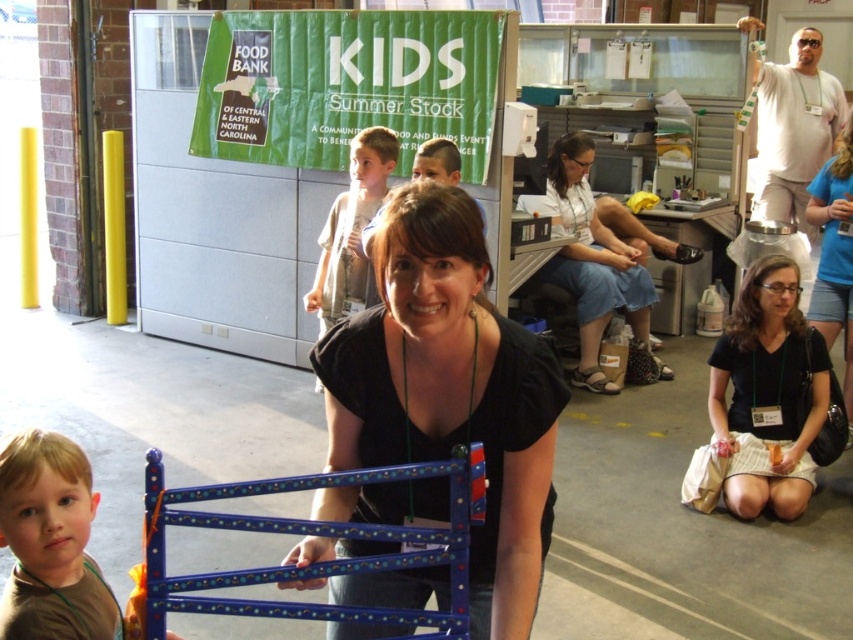
Question: Estimate the real-world distances between objects in this image. Which object is farther from the blue painted wood cart at center?

Choices:
 (A) black fabric shirt at lower right
 (B) brown matte shirt at lower left

Answer: (A)

Question: Estimate the real-world distances between objects in this image. Which object is farther from the denim skirt at center?

Choices:
 (A) light brown hair at center
 (B) blue painted wood cart at center
 (C) black fabric shirt at center

Answer: (B)

Question: Where is denim skirt at center located in relation to black fabric shirt at center in the image?

Choices:
 (A) right
 (B) left

Answer: (B)

Question: Can you confirm if blue painted wood cart at center is positioned to the right of light brown hair at center?

Choices:
 (A) yes
 (B) no

Answer: (A)

Question: Which object appears closest to the camera in this image?

Choices:
 (A) brown matte shirt at lower left
 (B) light brown hair at center
 (C) black fabric shirt at center

Answer: (A)

Question: Is blue painted wood cart at center in front of denim skirt at center?

Choices:
 (A) no
 (B) yes

Answer: (B)